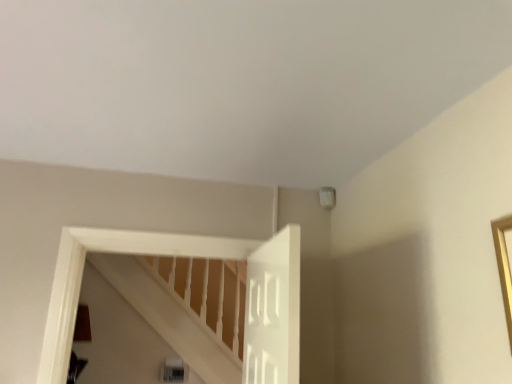
This screenshot has width=512, height=384. Describe the element at coordinates (504, 266) in the screenshot. I see `wooden frame at right` at that location.

What is the approximate width of wooden frame at right?

It is 1.48 inches.

In order to face wooden frame at right, should I rotate leftwards or rightwards?

You should look right and rotate roughly 37.117 degrees.

The image size is (512, 384). I want to click on wooden frame at right, so click(x=504, y=266).

Image resolution: width=512 pixels, height=384 pixels. What are the coordinates of `wooden frame at right` in the screenshot? It's located at (504, 266).